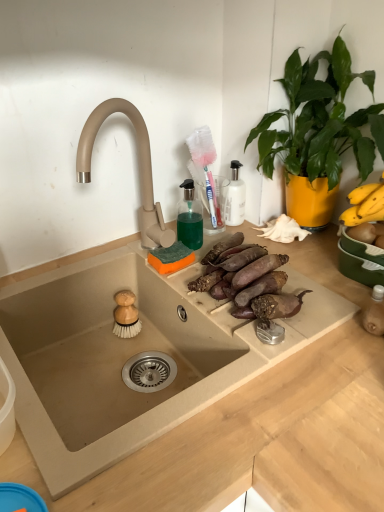
Question: Should I look upward or downward to see beige stone sink at center?

Choices:
 (A) down
 (B) up

Answer: (A)

Question: Is green leafy plant at upper right facing towards beige stone sink at center?

Choices:
 (A) yes
 (B) no

Answer: (A)

Question: Does green leafy plant at upper right appear on the right side of beige stone sink at center?

Choices:
 (A) yes
 (B) no

Answer: (A)

Question: Is green leafy plant at upper right thinner than beige stone sink at center?

Choices:
 (A) yes
 (B) no

Answer: (A)

Question: Would you say beige stone sink at center is part of green leafy plant at upper right's contents?

Choices:
 (A) no
 (B) yes

Answer: (A)

Question: Are green leafy plant at upper right and beige stone sink at center far apart?

Choices:
 (A) yes
 (B) no

Answer: (B)

Question: Considering the relative sizes of green leafy plant at upper right and beige stone sink at center in the image provided, is green leafy plant at upper right shorter than beige stone sink at center?

Choices:
 (A) no
 (B) yes

Answer: (A)

Question: Could you tell me if beige stone sink at center is turned towards brown rough sweet potatoes at center?

Choices:
 (A) no
 (B) yes

Answer: (A)

Question: Is beige stone sink at center thinner than brown rough sweet potatoes at center?

Choices:
 (A) yes
 (B) no

Answer: (B)

Question: Considering the relative positions of beige stone sink at center and brown rough sweet potatoes at center in the image provided, is beige stone sink at center to the left of brown rough sweet potatoes at center from the viewer's perspective?

Choices:
 (A) yes
 (B) no

Answer: (A)

Question: Is beige stone sink at center at the right side of brown rough sweet potatoes at center?

Choices:
 (A) yes
 (B) no

Answer: (B)

Question: Is beige stone sink at center wider than brown rough sweet potatoes at center?

Choices:
 (A) yes
 (B) no

Answer: (A)

Question: Does beige stone sink at center come behind brown rough sweet potatoes at center?

Choices:
 (A) yes
 (B) no

Answer: (B)

Question: From the image's perspective, would you say green leafy plant at upper right is positioned over brown rough sweet potatoes at center?

Choices:
 (A) no
 (B) yes

Answer: (B)